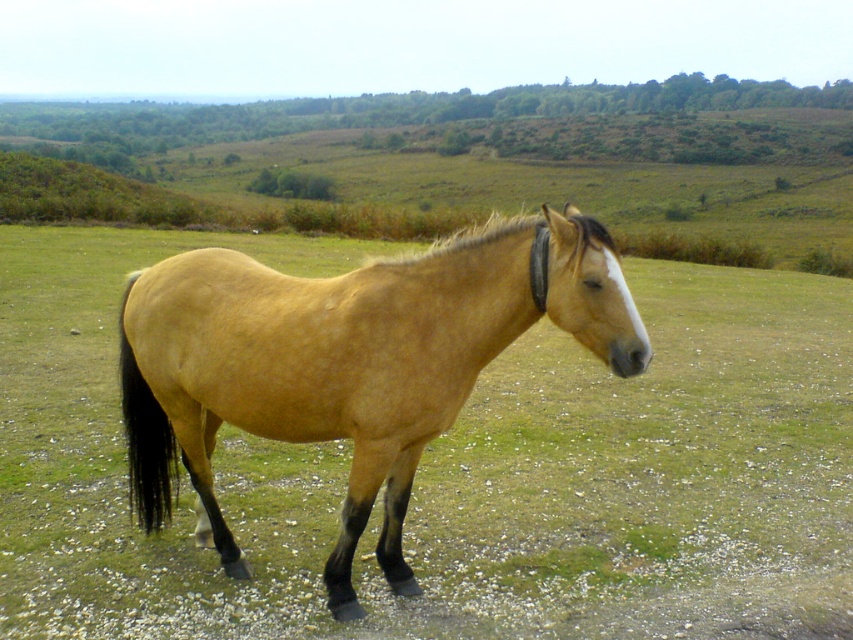
Can you confirm if golden matte horse at center is smaller than golden smooth mane at center?

Yes, golden matte horse at center is smaller than golden smooth mane at center.

Who is shorter, golden matte horse at center or golden smooth mane at center?

With less height is golden matte horse at center.

You are a GUI agent. You are given a task and a screenshot of the screen. Output one action in this format:
    pyautogui.click(x=<x>, y=<y>)
    Task: Click on the golden matte horse at center
    
    Given the screenshot: What is the action you would take?
    pyautogui.click(x=347, y=364)